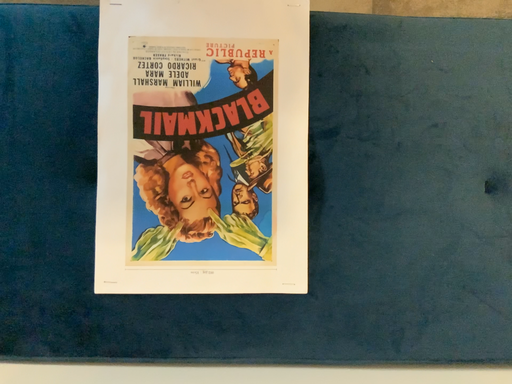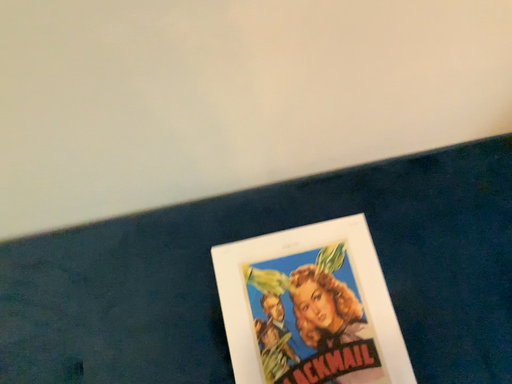
Question: Which way did the camera rotate in the video?

Choices:
 (A) rotated upward
 (B) rotated downward

Answer: (A)